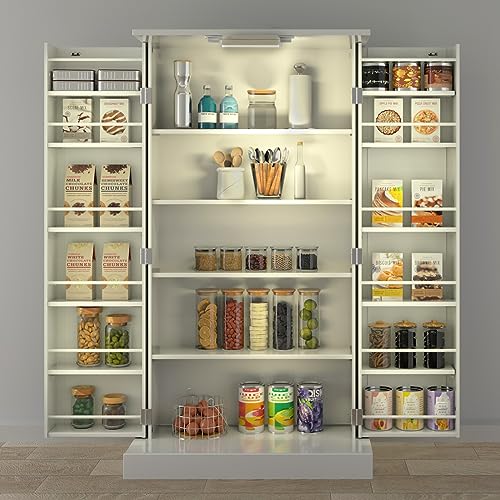
At what (x,y) coordinates should I click in order to perform the action: click on glass lids. Please return your answer as a coordinate pair (x, y). This screenshot has height=500, width=500. Looking at the image, I should click on (203, 244), (226, 247), (255, 245), (285, 245), (309, 248).